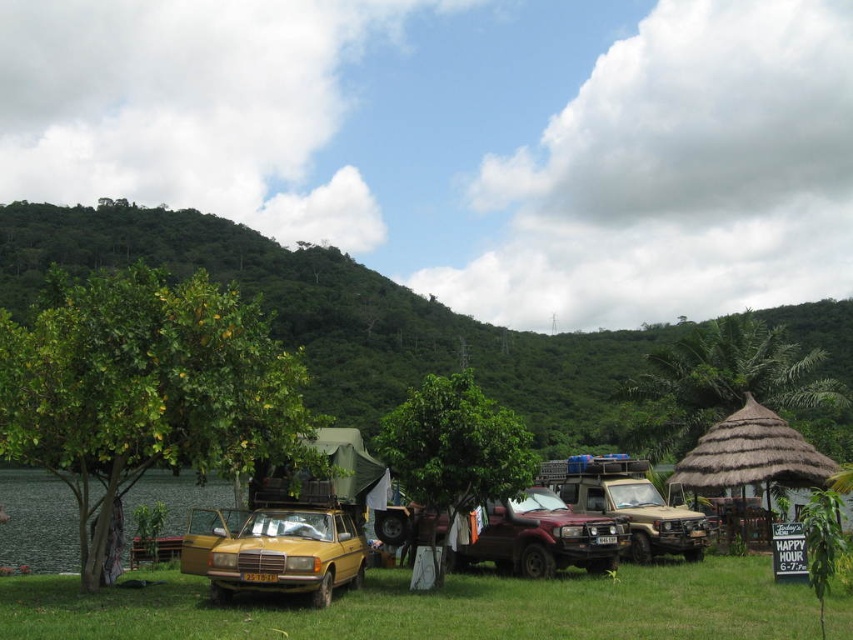
Question: Which point is closer to the camera?

Choices:
 (A) (849, 428)
 (B) (297, 538)

Answer: (B)

Question: Which object is closer to the camera taking this photo?

Choices:
 (A) beige matte jeep at center
 (B) green leafy tree at center
 (C) green grassy field at lower center

Answer: (C)

Question: Considering the relative positions of green leafy tree at upper center and matte yellow car at center in the image provided, where is green leafy tree at upper center located with respect to matte yellow car at center?

Choices:
 (A) right
 (B) left

Answer: (A)

Question: Does green leafy tree at left appear over beige matte jeep at center?

Choices:
 (A) no
 (B) yes

Answer: (B)

Question: From the image, what is the correct spatial relationship of matte yellow car at center in relation to beige matte jeep at center?

Choices:
 (A) left
 (B) right

Answer: (A)

Question: Considering the real-world distances, which object is closest to the green leafy tree at center?

Choices:
 (A) green canvas tent at center
 (B) rustic metallic suv at center

Answer: (A)